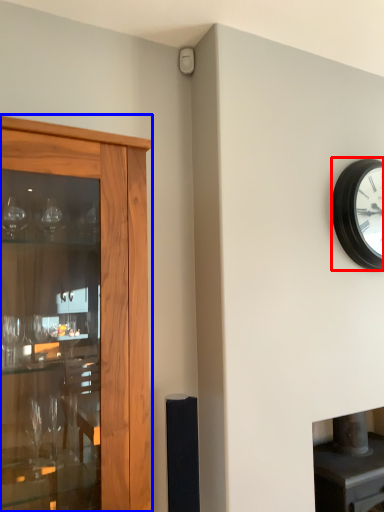
Question: Among these objects, which one is nearest to the camera, wall clock (highlighted by a red box) or cupboard (highlighted by a blue box)?

Choices:
 (A) wall clock
 (B) cupboard

Answer: (B)